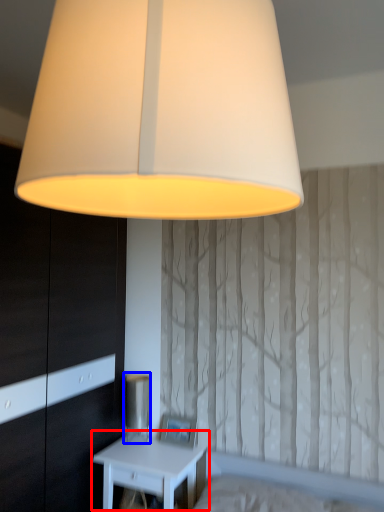
Question: Which object is closer to the camera taking this photo, nightstand (highlighted by a red box) or table lamp (highlighted by a blue box)?

Choices:
 (A) nightstand
 (B) table lamp

Answer: (A)